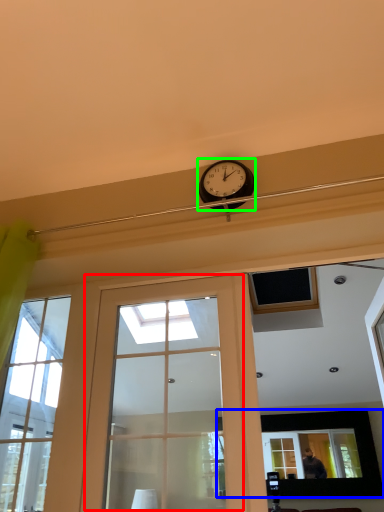
Question: Considering the real-world distances, which object is farthest from door (highlighted by a red box)? picture frame (highlighted by a blue box) or clock (highlighted by a green box)?

Choices:
 (A) picture frame
 (B) clock

Answer: (A)